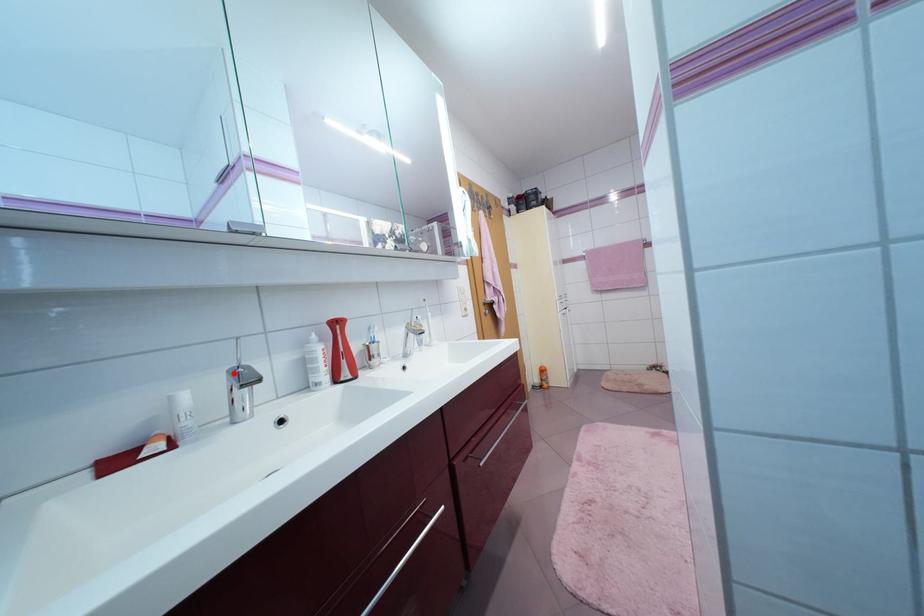
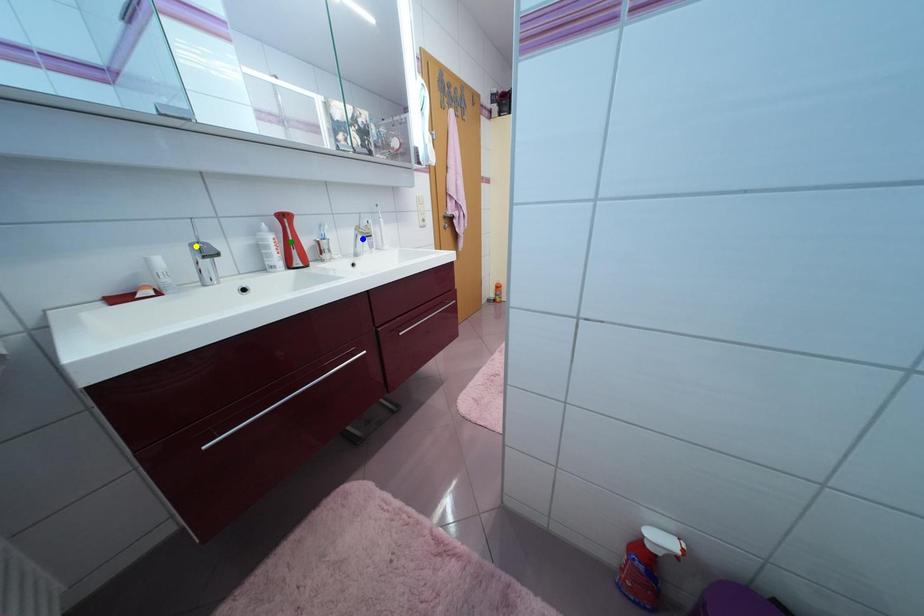
Question: I am providing you with two images of the same scene from different viewpoints. A red point is marked on the first image. You are given multiple points on the second image. Which mark in image 2 goes with the point in image 1?

Choices:
 (A) blue point
 (B) yellow point
 (C) green point

Answer: (B)